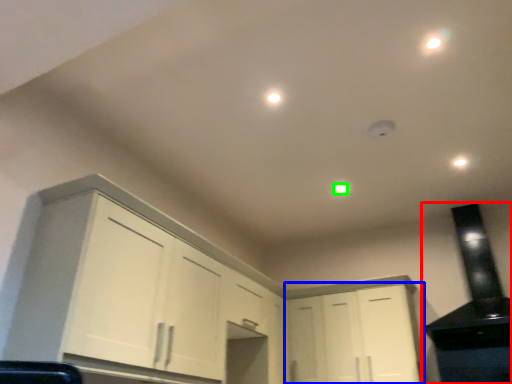
Question: Which object is the farthest from appliance (highlighted by a red box)? Choose among these: cabinetry (highlighted by a blue box) or dot (highlighted by a green box).

Choices:
 (A) cabinetry
 (B) dot

Answer: (B)